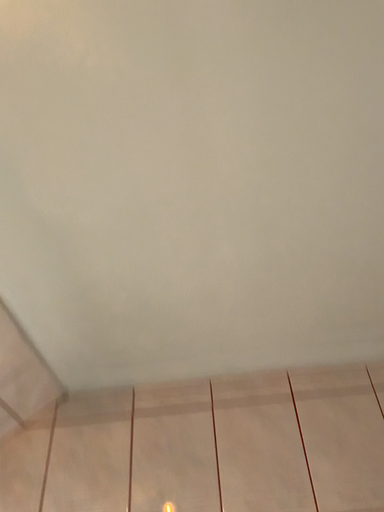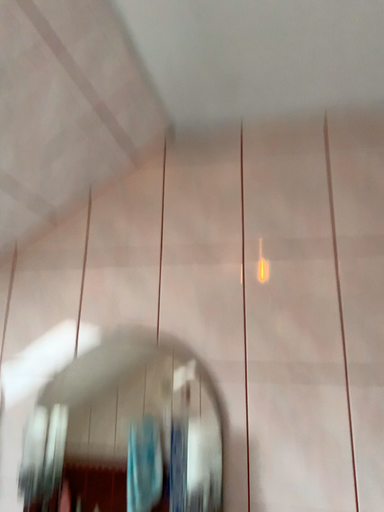
Question: How did the camera likely rotate when shooting the video?

Choices:
 (A) rotated downward
 (B) rotated upward

Answer: (A)